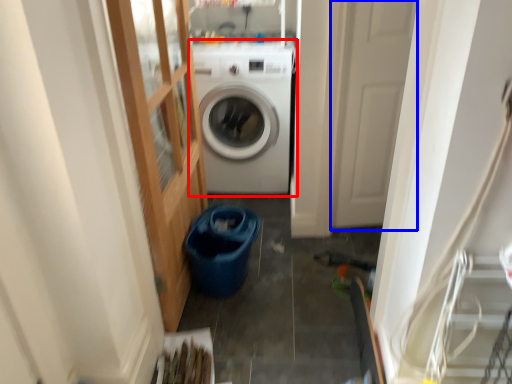
Question: Among these objects, which one is nearest to the camera, washing machine (highlighted by a red box) or screen door (highlighted by a blue box)?

Choices:
 (A) washing machine
 (B) screen door

Answer: (B)